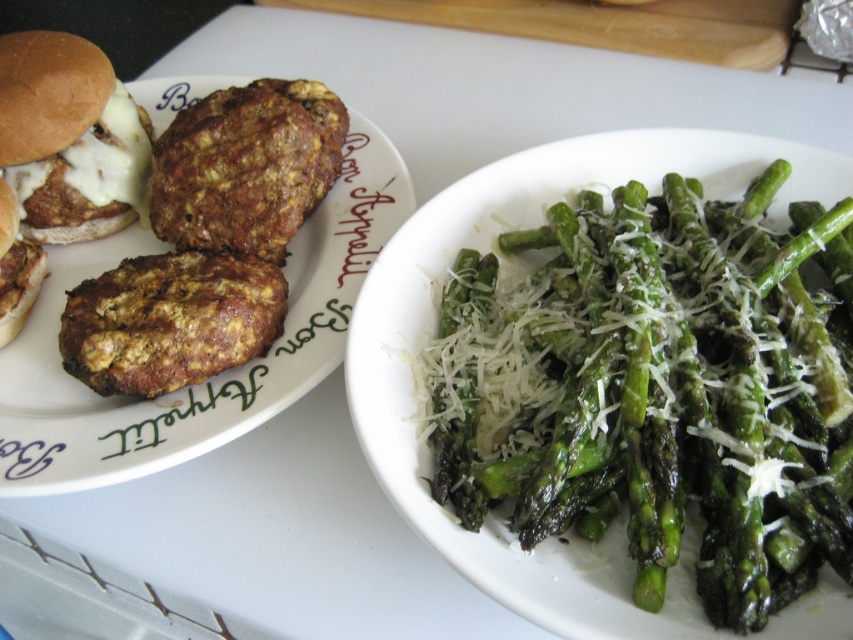
You are a food critic evaluating this meal. You notice two items labeled as brown crumbly meatballs at left and brown crumbly meat at upper left. Which of these two items is located more to the left in the image?

The brown crumbly meatballs at left is more to the left than the brown crumbly meat at upper left.